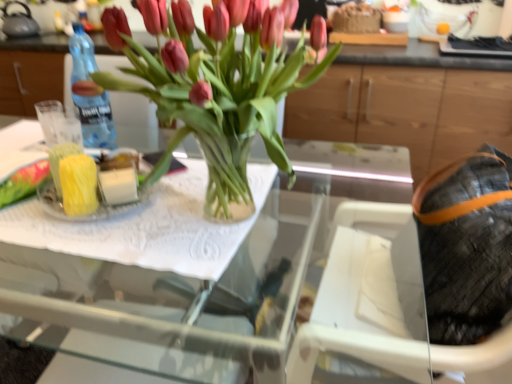
Question: Is leather textured bag at right at the back of transparent glass vase at center?

Choices:
 (A) yes
 (B) no

Answer: (A)

Question: Is leather textured bag at right located within transparent glass vase at center?

Choices:
 (A) no
 (B) yes

Answer: (A)

Question: Are transparent glass vase at center and leather textured bag at right beside each other?

Choices:
 (A) yes
 (B) no

Answer: (B)

Question: Is transparent glass vase at center at the left side of leather textured bag at right?

Choices:
 (A) yes
 (B) no

Answer: (A)

Question: Can we say transparent glass vase at center lies outside leather textured bag at right?

Choices:
 (A) yes
 (B) no

Answer: (A)

Question: Is transparent glass vase at center taller than leather textured bag at right?

Choices:
 (A) no
 (B) yes

Answer: (B)

Question: Considering the relative positions of wooden cabinet at upper center and clear glass tray at center in the image provided, is wooden cabinet at upper center to the left of clear glass tray at center from the viewer's perspective?

Choices:
 (A) yes
 (B) no

Answer: (B)

Question: Considering the relative positions of wooden cabinet at upper center and clear glass tray at center in the image provided, is wooden cabinet at upper center behind clear glass tray at center?

Choices:
 (A) yes
 (B) no

Answer: (A)

Question: Is wooden cabinet at upper center smaller than clear glass tray at center?

Choices:
 (A) yes
 (B) no

Answer: (B)

Question: Is wooden cabinet at upper center positioned with its back to clear glass tray at center?

Choices:
 (A) no
 (B) yes

Answer: (B)

Question: Does wooden cabinet at upper center contain clear glass tray at center?

Choices:
 (A) no
 (B) yes

Answer: (A)

Question: Is wooden cabinet at upper center shorter than clear glass tray at center?

Choices:
 (A) yes
 (B) no

Answer: (B)

Question: Would you say matte gray kettle at upper left is a long distance from blue plastic bottle at left?

Choices:
 (A) yes
 (B) no

Answer: (A)